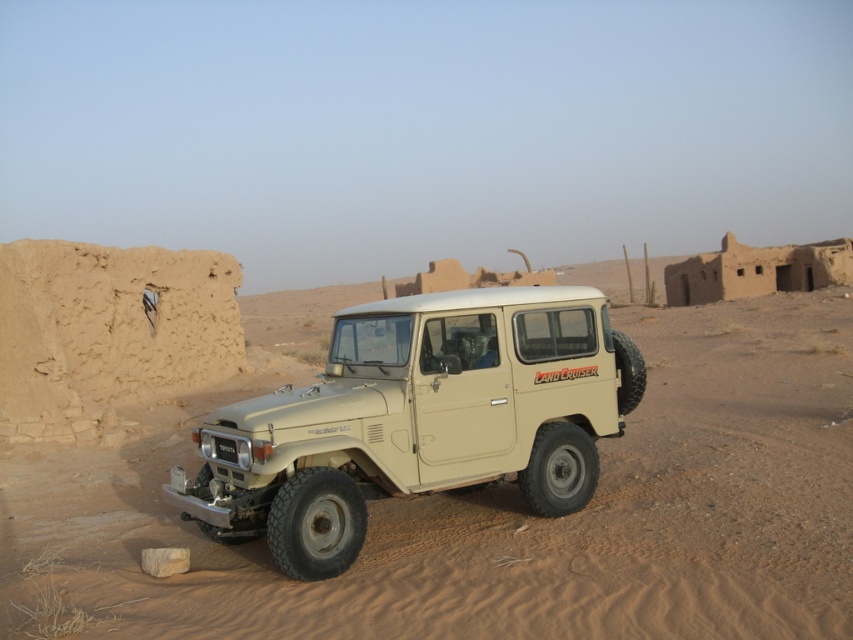
Question: Which of the following is the closest to the observer?

Choices:
 (A) (120, 508)
 (B) (544, 348)

Answer: (B)

Question: Is beige sand at center further to the viewer compared to beige matte landcruiser at center?

Choices:
 (A) yes
 (B) no

Answer: (B)

Question: Is beige sand at center to the left of beige matte landcruiser at center from the viewer's perspective?

Choices:
 (A) yes
 (B) no

Answer: (B)

Question: Is beige sand at center wider than beige matte landcruiser at center?

Choices:
 (A) no
 (B) yes

Answer: (B)